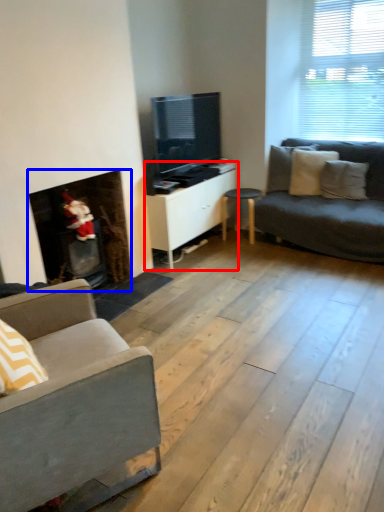
Question: Which point is further to the camera, cabinetry (highlighted by a red box) or fireplace (highlighted by a blue box)?

Choices:
 (A) cabinetry
 (B) fireplace

Answer: (A)